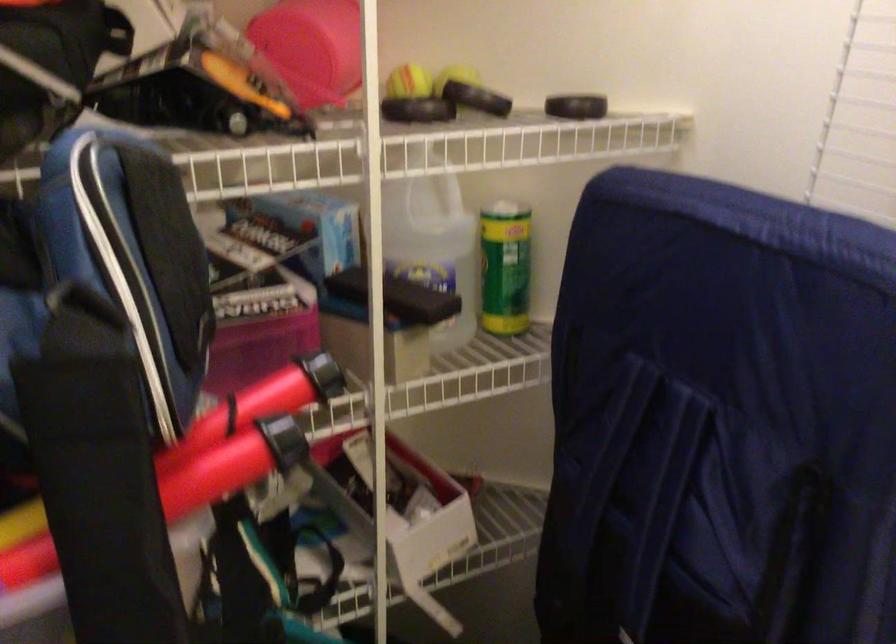
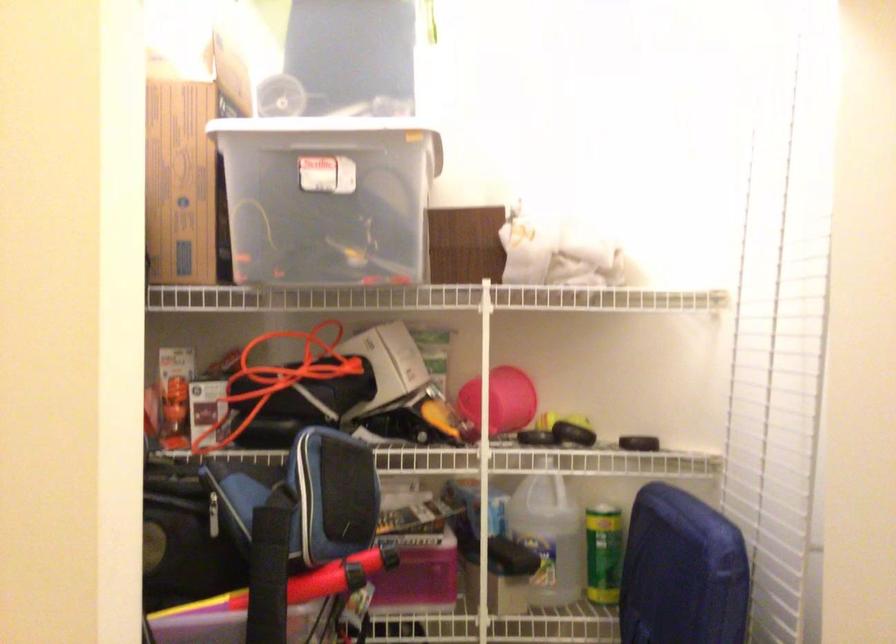
Locate, in the second image, the point that corresponds to [812,313] in the first image.

(682, 572)